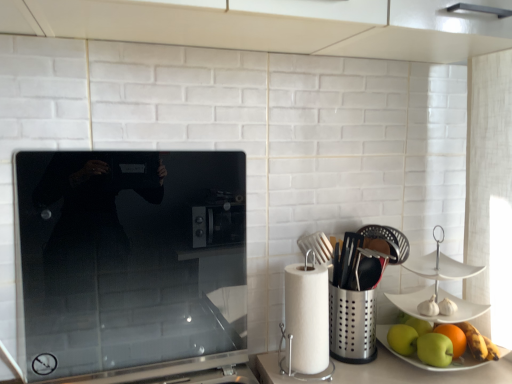
Question: Can you confirm if smooth glass cooktop at center is taller than green matte apple at lower right, acting as the second apple starting from the left?

Choices:
 (A) yes
 (B) no

Answer: (A)

Question: Is the position of smooth glass cooktop at center more distant than that of green matte apple at lower right, acting as the second apple starting from the left?

Choices:
 (A) yes
 (B) no

Answer: (B)

Question: Can you confirm if smooth glass cooktop at center is bigger than green matte apple at lower right, arranged as the second apple when viewed from the right?

Choices:
 (A) yes
 (B) no

Answer: (A)

Question: Is smooth glass cooktop at center positioned with its back to green matte apple at lower right, arranged as the second apple when viewed from the right?

Choices:
 (A) no
 (B) yes

Answer: (A)

Question: Does smooth glass cooktop at center turn towards green matte apple at lower right, acting as the second apple starting from the left?

Choices:
 (A) yes
 (B) no

Answer: (B)

Question: Does smooth glass cooktop at center have a greater width compared to green matte apple at lower right, acting as the second apple starting from the left?

Choices:
 (A) no
 (B) yes

Answer: (A)

Question: From a real-world perspective, is green matte apple at lower right, arranged as the second apple when viewed from the right, physically above smooth glass cooktop at center?

Choices:
 (A) no
 (B) yes

Answer: (A)

Question: Would you consider green matte apple at lower right, acting as the second apple starting from the left, to be distant from smooth glass cooktop at center?

Choices:
 (A) no
 (B) yes

Answer: (A)

Question: Does green matte apple at lower right, acting as the second apple starting from the left, come in front of smooth glass cooktop at center?

Choices:
 (A) yes
 (B) no

Answer: (B)

Question: From the image's perspective, does green matte apple at lower right, arranged as the second apple when viewed from the right, appear lower than smooth glass cooktop at center?

Choices:
 (A) yes
 (B) no

Answer: (A)

Question: Considering the relative positions of green matte apple at lower right, arranged as the second apple when viewed from the right, and smooth glass cooktop at center in the image provided, is green matte apple at lower right, arranged as the second apple when viewed from the right, behind smooth glass cooktop at center?

Choices:
 (A) no
 (B) yes

Answer: (B)

Question: Can you confirm if green matte apple at lower right, acting as the second apple starting from the left, is shorter than smooth glass cooktop at center?

Choices:
 (A) no
 (B) yes

Answer: (B)

Question: Could you tell me if smooth glass cooktop at center is facing white paper towel at right?

Choices:
 (A) yes
 (B) no

Answer: (B)